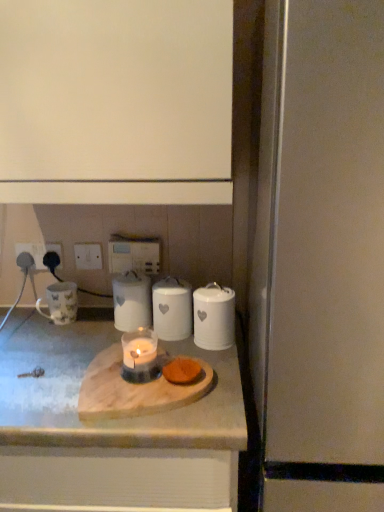
Question: From a real-world perspective, is white ceramic candle at center, which is the 2th appliance in left-to-right order, physically below white matte cabinet at upper center?

Choices:
 (A) yes
 (B) no

Answer: (A)

Question: Is white ceramic candle at center, which is the 2th appliance in left-to-right order, facing towards white matte cabinet at upper center?

Choices:
 (A) yes
 (B) no

Answer: (B)

Question: Is white ceramic candle at center, which appears as the 4th appliance when viewed from the right, to the left of white matte cabinet at upper center from the viewer's perspective?

Choices:
 (A) no
 (B) yes

Answer: (A)

Question: Is white ceramic candle at center, which is the 2th appliance in left-to-right order, shorter than white matte cabinet at upper center?

Choices:
 (A) yes
 (B) no

Answer: (A)

Question: Is white ceramic candle at center, which appears as the 4th appliance when viewed from the right, positioned beyond the bounds of white matte cabinet at upper center?

Choices:
 (A) yes
 (B) no

Answer: (A)

Question: Visually, is white ceramic jar at right, the second appliance when ordered from right to left, positioned to the left or to the right of satin silver fridge at right, the 1th appliance positioned from the right?

Choices:
 (A) left
 (B) right

Answer: (A)

Question: Do you think white ceramic jar at right, the second appliance when ordered from right to left, is within satin silver fridge at right, placed as the fifth appliance when sorted from left to right, or outside of it?

Choices:
 (A) inside
 (B) outside

Answer: (B)

Question: Considering the positions of point (221, 336) and point (352, 1), is point (221, 336) closer or farther from the camera than point (352, 1)?

Choices:
 (A) closer
 (B) farther

Answer: (B)

Question: Based on their sizes in the image, would you say white ceramic jar at right, the fourth appliance in the left-to-right sequence, is bigger or smaller than satin silver fridge at right, the 1th appliance positioned from the right?

Choices:
 (A) big
 (B) small

Answer: (B)

Question: Looking at their shapes, would you say white ceramic jar at center, which is the 3th appliance in left-to-right order, is wider or thinner than white ceramic jar at right, the second appliance when ordered from right to left?

Choices:
 (A) wide
 (B) thin

Answer: (A)

Question: Would you say white ceramic jar at center, which is the 3th appliance in left-to-right order, is inside or outside white ceramic jar at right, the fourth appliance in the left-to-right sequence?

Choices:
 (A) outside
 (B) inside

Answer: (A)

Question: In terms of height, does white ceramic jar at center, which is the 3th appliance in left-to-right order, look taller or shorter compared to white ceramic jar at right, the fourth appliance in the left-to-right sequence?

Choices:
 (A) short
 (B) tall

Answer: (A)

Question: Considering the positions of white ceramic jar at center, the 3th appliance in the right-to-left sequence, and white ceramic jar at right, the fourth appliance in the left-to-right sequence, in the image, is white ceramic jar at center, the 3th appliance in the right-to-left sequence, bigger or smaller than white ceramic jar at right, the fourth appliance in the left-to-right sequence,?

Choices:
 (A) big
 (B) small

Answer: (A)

Question: From a real-world perspective, relative to white marble countertop at center, is white matte cabinet at upper center vertically above or below?

Choices:
 (A) above
 (B) below

Answer: (A)

Question: Is point (215, 76) positioned closer to the camera than point (72, 477)?

Choices:
 (A) closer
 (B) farther

Answer: (A)